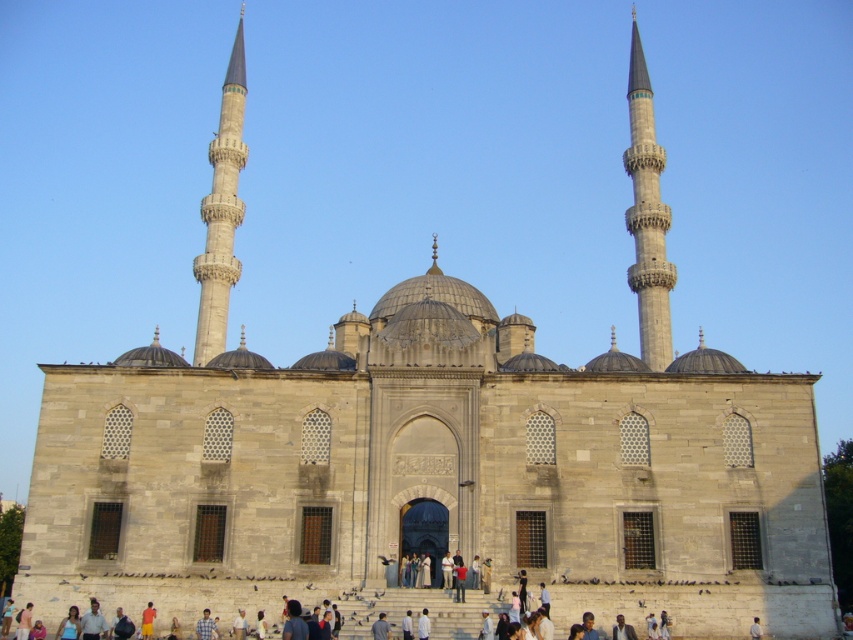
You are standing in front of the mosque and want to take a photo of both gray stone minaret at right and gray stone minaret at left. Which direction should you face to ensure both are visible in your camera frame?

You should face towards the center of the mosque between the two minarets so that both gray stone minaret at right and gray stone minaret at left are visible in your camera frame.

You are standing at the center of the mosque facing the entrance. Based on the coordinates provided, is the gray stone minaret at right located to your left or right side?

The gray stone minaret at right is located to your right side as its coordinates are at point (647, 216), which places it on the right side of the mosque from the center facing the entrance.